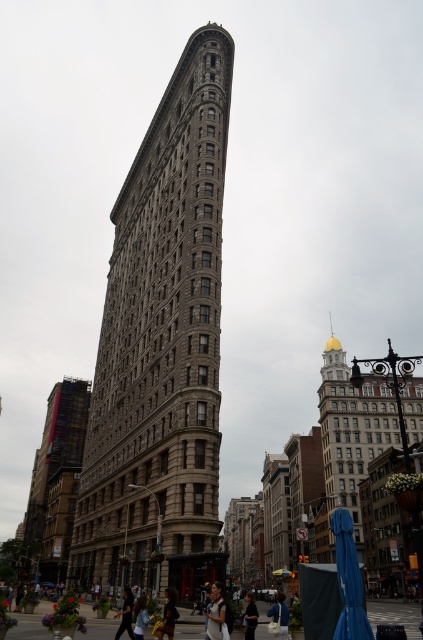
Can you confirm if gold dome building at right is positioned below light brown leather jacket at lower center?

Incorrect, gold dome building at right is not positioned below light brown leather jacket at lower center.

What do you see at coordinates (351, 432) in the screenshot? I see `gold dome building at right` at bounding box center [351, 432].

Which is behind, point (326, 368) or point (269, 612)?

Positioned behind is point (326, 368).

The height and width of the screenshot is (640, 423). Identify the location of gold dome building at right. click(351, 432).

Who is lower down, matte black jacket at lower center or dark blue jeans at center?

dark blue jeans at center is lower down.

Is point (230, 627) behind point (129, 589)?

No.

This screenshot has width=423, height=640. I want to click on matte black jacket at lower center, so click(x=217, y=614).

Between point (129, 636) and point (253, 600), which one is positioned behind?

Point (253, 600)

Locate an element on the screen. dark blue jeans at center is located at coordinates (126, 614).

This screenshot has height=640, width=423. Find the location of `dark blue jeans at center`. dark blue jeans at center is located at coordinates (126, 614).